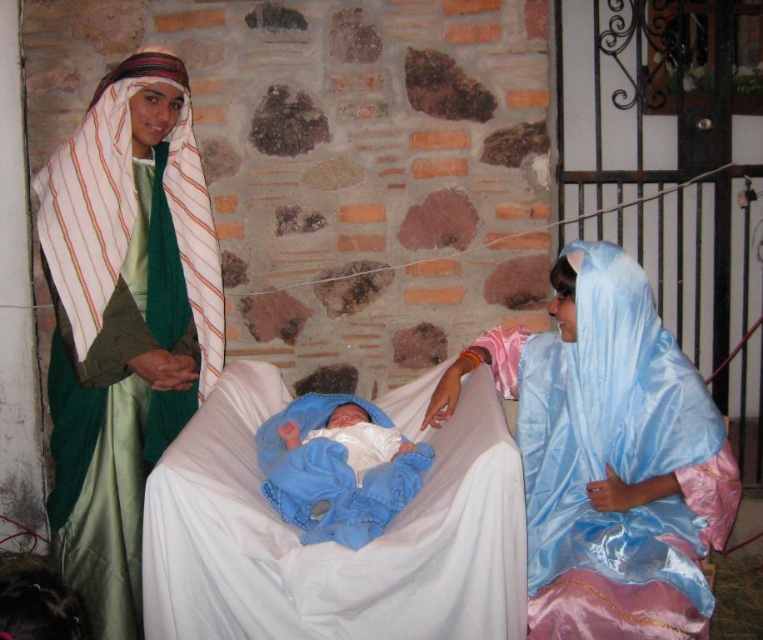
Question: Among these objects, which one is farthest from the camera?

Choices:
 (A) satin blue fabric at right
 (B) silky blue fabric at center
 (C) white satin infant bed at center
 (D) blue satin newborn at center

Answer: (B)

Question: Which point appears farthest from the camera in this image?

Choices:
 (A) (380, 460)
 (B) (401, 429)
 (C) (314, 522)
 (D) (459, 365)

Answer: (B)

Question: Is silky blue fabric at center thinner than blue satin baby at center?

Choices:
 (A) no
 (B) yes

Answer: (A)

Question: Is silky blue fabric at center in front of blue satin baby at center?

Choices:
 (A) no
 (B) yes

Answer: (A)

Question: Does silky blue fabric at center appear on the left side of satin blue fabric at right?

Choices:
 (A) no
 (B) yes

Answer: (B)

Question: Considering the real-world distances, which object is closest to the blue satin baby at center?

Choices:
 (A) satin blue fabric at right
 (B) blue satin newborn at center
 (C) silky blue fabric at center

Answer: (B)